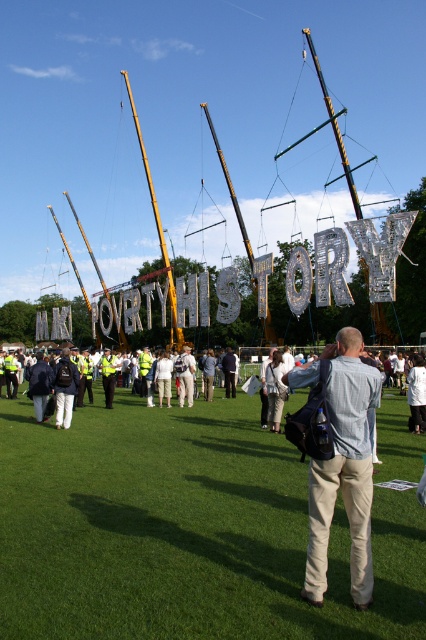
Does wooden mast at center have a greater width compared to black polished wood mast at center?

Yes.

Is point (89, 250) less distant than point (74, 269)?

Yes, point (89, 250) is in front of point (74, 269).

Which is behind, point (103, 278) or point (46, 205)?

The point (46, 205) is behind.

Where is `wooden mast at center`? The height and width of the screenshot is (640, 426). wooden mast at center is located at coordinates (89, 248).

Can you confirm if light blue shirt at center is positioned below black polished wood mast at center?

Yes.

Is light blue shirt at center taller than black polished wood mast at center?

In fact, light blue shirt at center may be shorter than black polished wood mast at center.

Image resolution: width=426 pixels, height=640 pixels. What are the coordinates of `light blue shirt at center` in the screenshot? It's located at (342, 465).

Between light blue shirt at center and yellow metallic mast at center, which one appears on the right side from the viewer's perspective?

Positioned to the right is light blue shirt at center.

Which of these two, light blue shirt at center or yellow metallic mast at center, stands taller?

yellow metallic mast at center is taller.

Describe the element at coordinates (342, 465) in the screenshot. Image resolution: width=426 pixels, height=640 pixels. I see `light blue shirt at center` at that location.

Locate an element on the screen. This screenshot has width=426, height=640. light blue shirt at center is located at coordinates (342, 465).